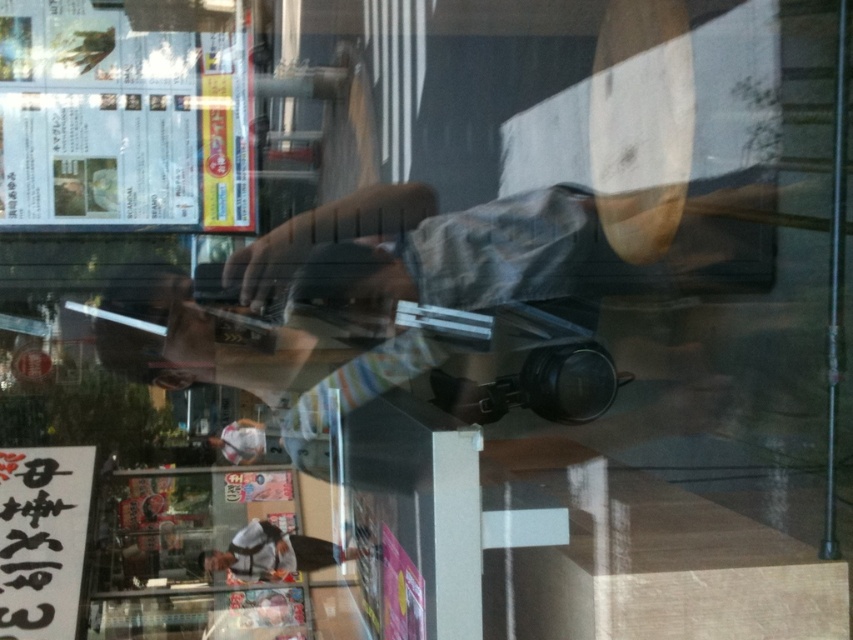
Who is positioned more to the right, gray fabric shirt at center or white plastic bag at lower center?

From the viewer's perspective, gray fabric shirt at center appears more on the right side.

Does gray fabric shirt at center appear over white plastic bag at lower center?

Yes, gray fabric shirt at center is above white plastic bag at lower center.

Describe the element at coordinates (523, 244) in the screenshot. I see `gray fabric shirt at center` at that location.

Find the location of `gray fabric shirt at center`. gray fabric shirt at center is located at coordinates (523, 244).